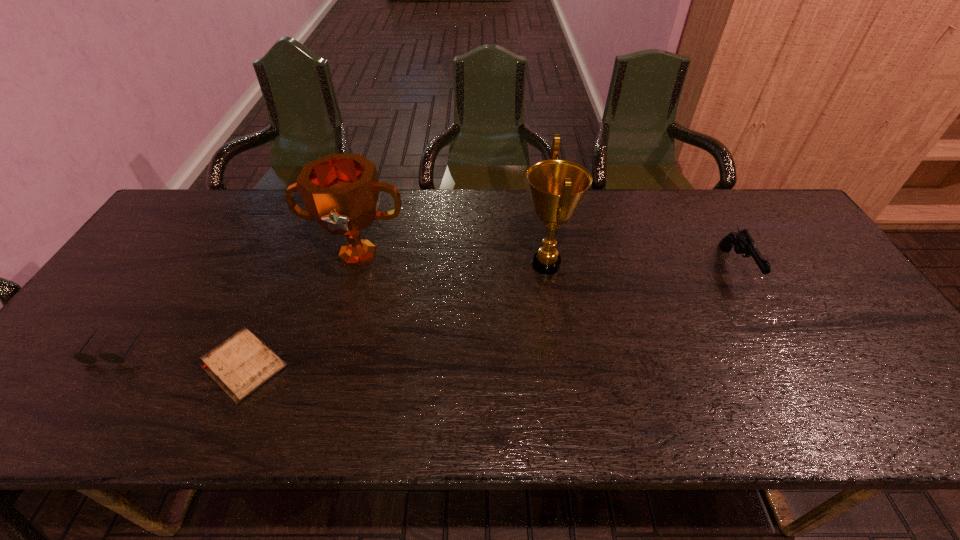
The width and height of the screenshot is (960, 540). Find the location of `blank area at the near edge`. blank area at the near edge is located at coordinates (695, 411).

In the image, there is a desktop. What are the coordinates of `free space at the far left corner` in the screenshot? It's located at (181, 213).

Identify the location of vacant space at the far right corner of the desktop. (768, 213).

In the image, there is a desktop. Where is `vacant space at the near right corner`? vacant space at the near right corner is located at coordinates (909, 424).

Find the location of `free space between the shorter award and the diary`. free space between the shorter award and the diary is located at coordinates (300, 310).

I want to click on free point between the shortest object and the rightmost object, so click(x=490, y=317).

I want to click on vacant area that lies between the fourth shortest object and the shortest object, so click(x=300, y=310).

The image size is (960, 540). Find the location of `vacant region between the leftmost object and the taller award`. vacant region between the leftmost object and the taller award is located at coordinates coord(331,307).

Where is `free space between the shorter award and the second object from right to left`? The height and width of the screenshot is (540, 960). free space between the shorter award and the second object from right to left is located at coordinates (452, 259).

Image resolution: width=960 pixels, height=540 pixels. In order to click on empty space between the sunglasses and the tallest object in this screenshot , I will do `click(331, 307)`.